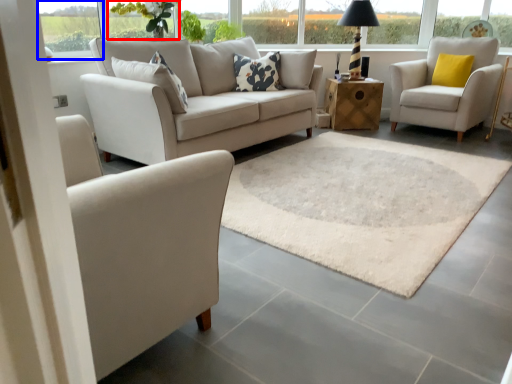
Question: Among these objects, which one is farthest to the camera, flower (highlighted by a red box) or window (highlighted by a blue box)?

Choices:
 (A) flower
 (B) window

Answer: (A)